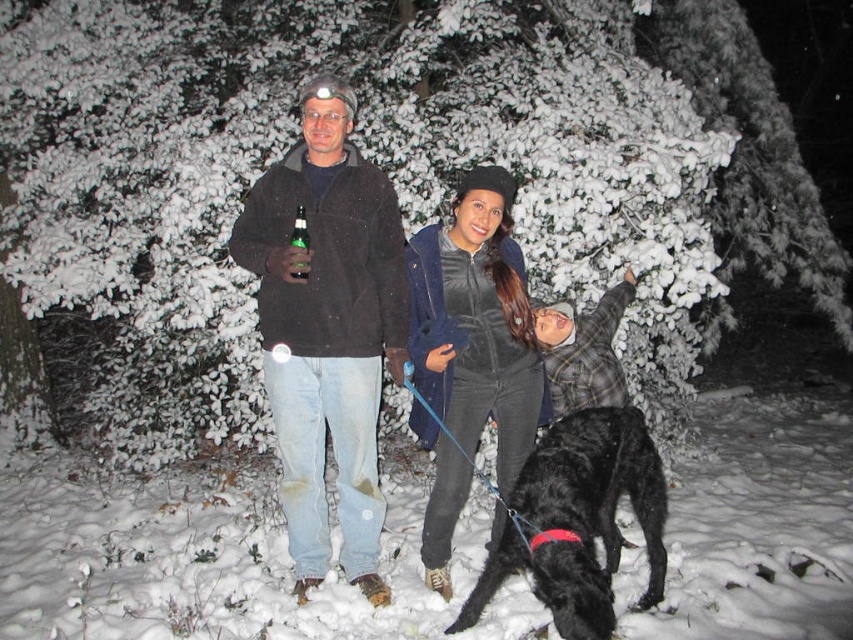
Image resolution: width=853 pixels, height=640 pixels. What do you see at coordinates (328, 330) in the screenshot?
I see `dark brown jacket at center` at bounding box center [328, 330].

Is dark brown jacket at center to the right of velvet black jacket at center from the viewer's perspective?

Incorrect, dark brown jacket at center is not on the right side of velvet black jacket at center.

The width and height of the screenshot is (853, 640). What do you see at coordinates (328, 330) in the screenshot? I see `dark brown jacket at center` at bounding box center [328, 330].

I want to click on dark brown jacket at center, so click(328, 330).

This screenshot has width=853, height=640. What do you see at coordinates (387, 173) in the screenshot?
I see `snow-covered evergreen tree at upper center` at bounding box center [387, 173].

Can you confirm if snow-covered evergreen tree at upper center is shorter than shiny black fur at center?

Correct, snow-covered evergreen tree at upper center is not as tall as shiny black fur at center.

Where is `snow-covered evergreen tree at upper center`? The height and width of the screenshot is (640, 853). snow-covered evergreen tree at upper center is located at coordinates (387, 173).

Identify the location of snow-covered evergreen tree at upper center. This screenshot has width=853, height=640. (387, 173).

Which is more to the left, shiny black fur at center or green glass bottle at center?

green glass bottle at center is more to the left.

Who is positioned more to the right, shiny black fur at center or green glass bottle at center?

shiny black fur at center

Is point (659, 563) positioned in front of point (305, 228)?

No, (659, 563) is further to viewer.

I want to click on shiny black fur at center, so click(579, 520).